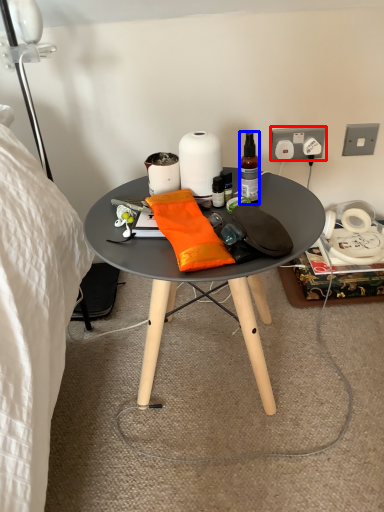
Question: Which of the following is the farthest to the observer, power outlet (highlighted by a red box) or bottle (highlighted by a blue box)?

Choices:
 (A) power outlet
 (B) bottle

Answer: (A)